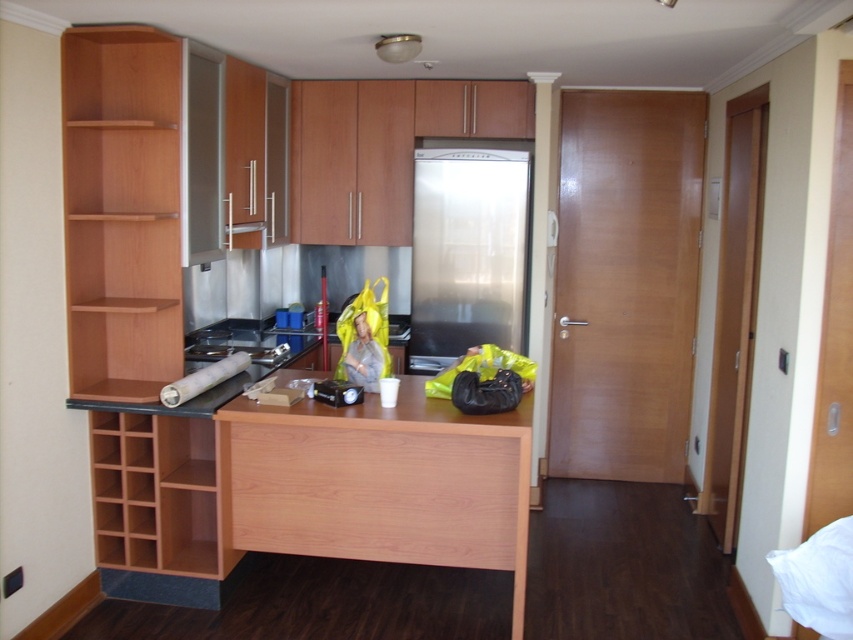
Which is behind, point (343, 534) or point (479, 172)?

The point (479, 172) is behind.

Can you confirm if light wood drawer at center is shorter than stainless steel refrigerator at center?

Yes, light wood drawer at center is shorter than stainless steel refrigerator at center.

Identify the location of light wood drawer at center. (380, 493).

Can you confirm if light brown wood shelf at left is positioned to the right of light wood drawer at center?

In fact, light brown wood shelf at left is to the left of light wood drawer at center.

Who is taller, light brown wood shelf at left or light wood drawer at center?

With more height is light brown wood shelf at left.

At what (x,y) coordinates should I click in order to perform the action: click on light brown wood shelf at left. Please return your answer as a coordinate pair (x, y). Image resolution: width=853 pixels, height=640 pixels. Looking at the image, I should click on (x=120, y=211).

Looking at this image, does stainless steel refrigerator at center appear under brushed metal sink at center?

Incorrect, stainless steel refrigerator at center is not positioned below brushed metal sink at center.

Who is more forward, [485,212] or [248,352]?

Point [248,352] is more forward.

Identify the location of stainless steel refrigerator at center. This screenshot has width=853, height=640. (467, 252).